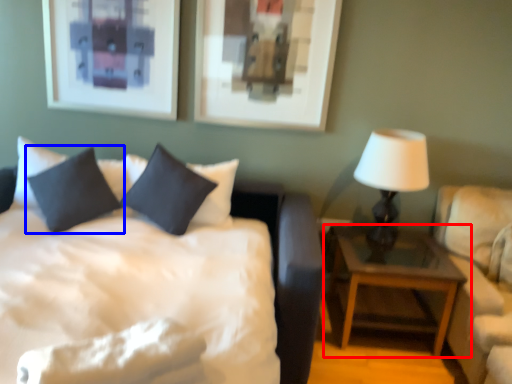
Question: Among these objects, which one is nearest to the camera, nightstand (highlighted by a red box) or pillow (highlighted by a blue box)?

Choices:
 (A) nightstand
 (B) pillow

Answer: (B)